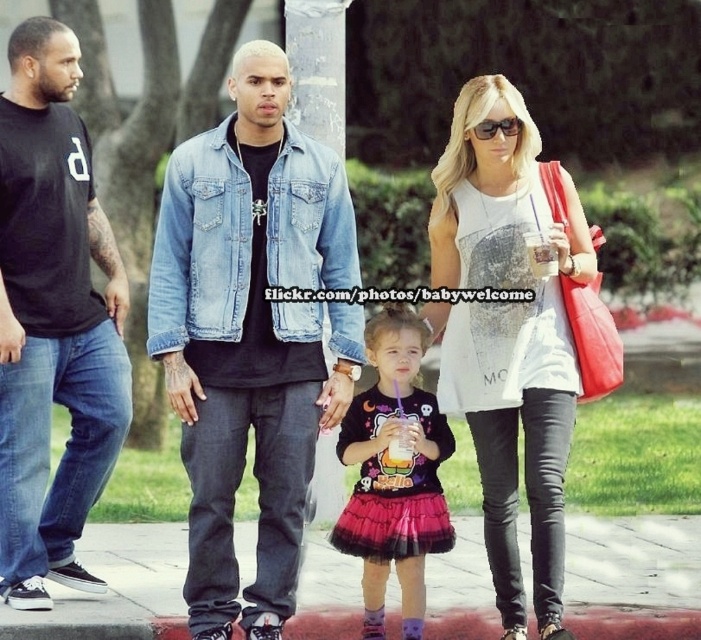
You are standing at point (x=512, y=116) and want to walk to point (x=8, y=211). Is there any object blocking your path between these two points?

Point (x=8, y=211) is behind point (x=512, y=116), so there is no object blocking the path between them.

You are standing at the point marked by the coordinate point at (186,180). You want to walk to the nearest tree located 16.08 meters away. Is the tree in the middle ground or the foreground?

The point at (186,180) is 16.08 meters away from the viewer. Since the foreground is closer to the viewer than the middle ground, the tree must be in the middle ground because it is farther away.

You are standing at the point marked by coordinates point (251, 333). Which object is located exactly at this point?

The point (251, 333) corresponds to the faded denim jacket at center.